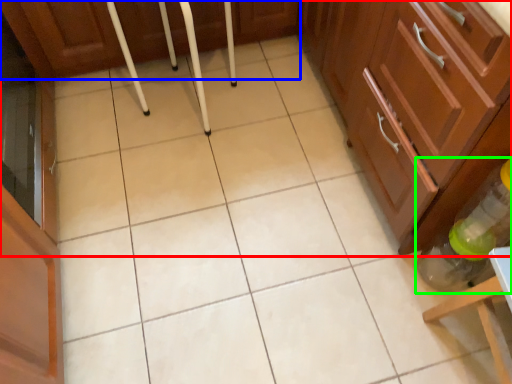
Question: Which object is positioned closest to cabinetry (highlighted by a red box)? Select from cabinetry (highlighted by a blue box) and bottle (highlighted by a green box).

Choices:
 (A) cabinetry
 (B) bottle

Answer: (B)